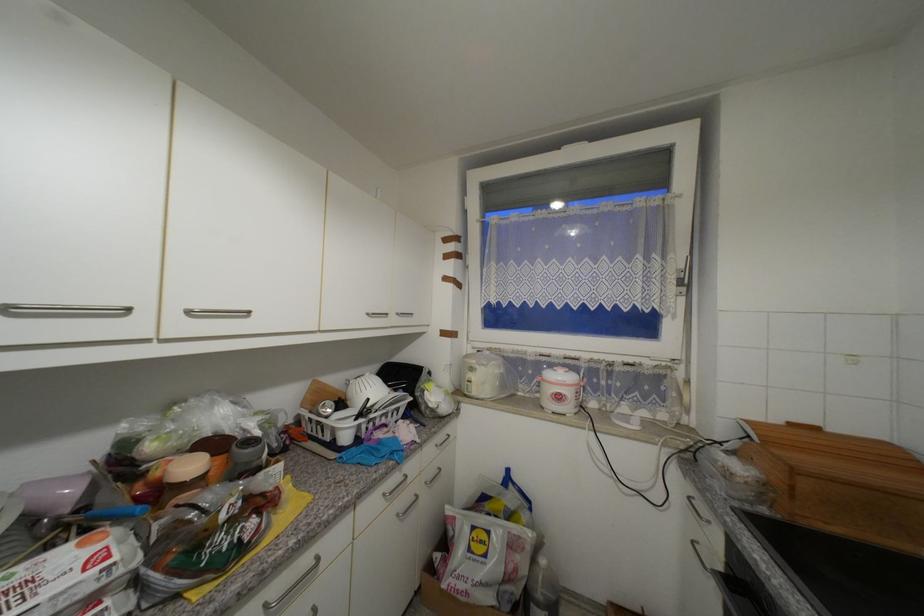
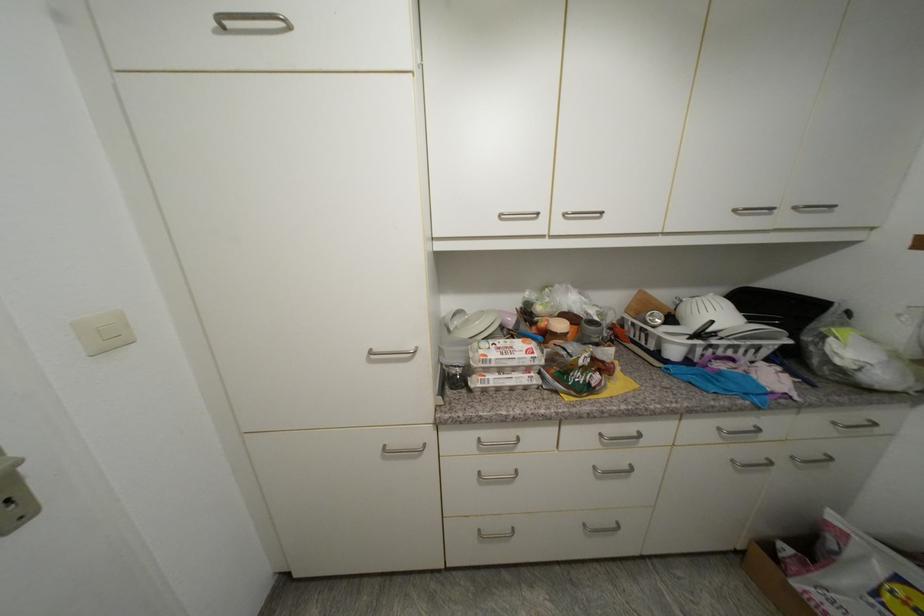
The point at (403, 516) is marked in the first image. Where is the corresponding point in the second image?

(738, 463)